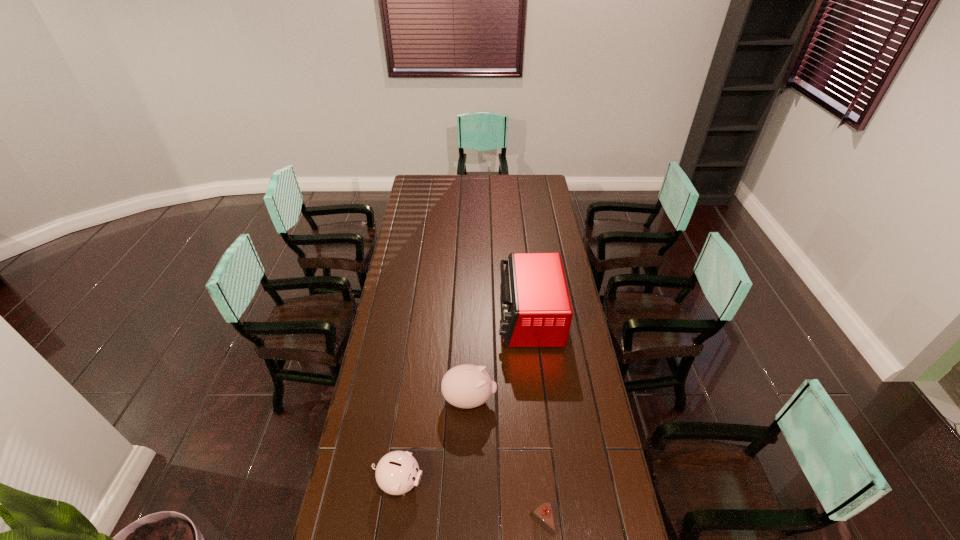
Identify the location of vacant point located 0.380m on the front-facing side of the toaster oven. The image size is (960, 540). (412, 318).

Identify the location of vacant region located at the snout of the taller piggy bank. (576, 400).

Identify the location of vacant space located 0.310m on the back of the shorter piggy bank. point(412,383).

At what (x,y) coordinates should I click in order to perform the action: click on free space located 0.240m on the back of the shortest object. Please return your answer as a coordinate pair (x, y). The height and width of the screenshot is (540, 960). Looking at the image, I should click on (535, 436).

Find the location of `object positioned at the left edge`. object positioned at the left edge is located at coordinates (397, 472).

Identify the location of object at the right edge. (536, 308).

Where is `vacant area at the left edge of the desktop`? Image resolution: width=960 pixels, height=540 pixels. vacant area at the left edge of the desktop is located at coordinates (400, 275).

You are a GUI agent. You are given a task and a screenshot of the screen. Output one action in this format:
    pyautogui.click(x=<x>, y=<y>)
    Task: Click on the free space at the right edge
    This screenshot has height=540, width=960.
    Given the screenshot: What is the action you would take?
    pyautogui.click(x=561, y=377)

Locate an element on the screen. This screenshot has width=960, height=540. free area in between the shorter piggy bank and the right piggy bank is located at coordinates (434, 441).

You are a GUI agent. You are given a task and a screenshot of the screen. Output one action in this format:
    pyautogui.click(x=<x>, y=<y>)
    Task: Click on the vacant space that's between the chocolate cake and the third tallest object
    Image resolution: width=960 pixels, height=540 pixels.
    Given the screenshot: What is the action you would take?
    pyautogui.click(x=470, y=502)